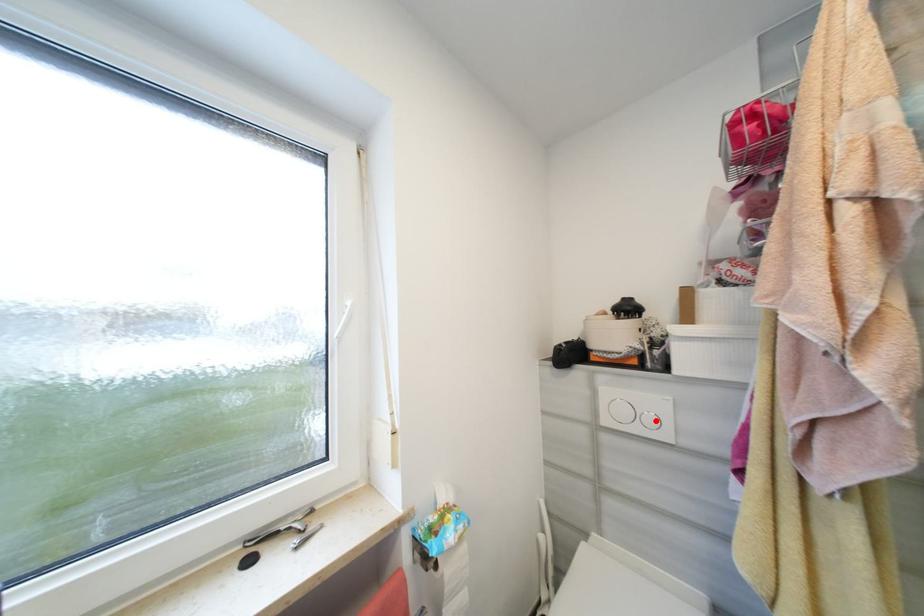
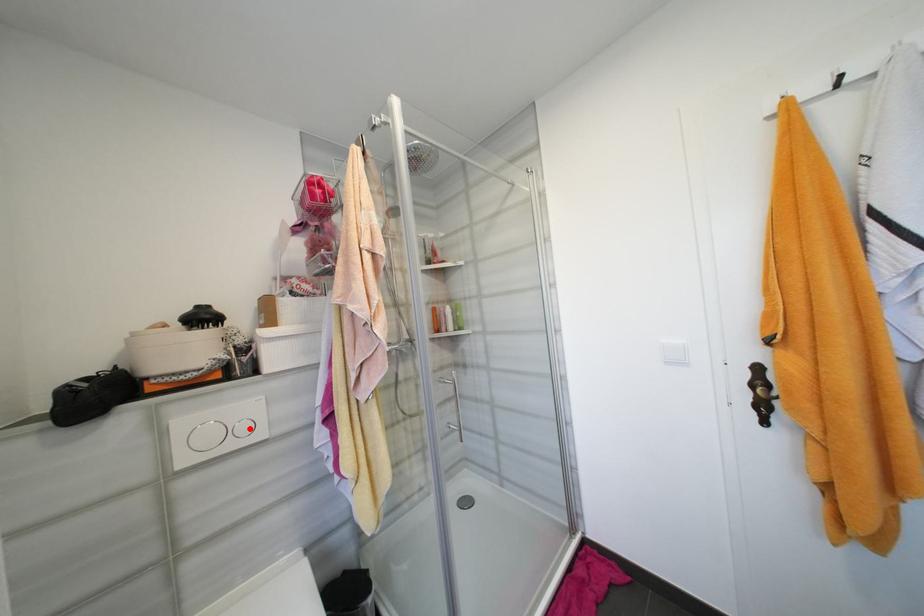
I am providing you with two images of the same scene from different viewpoints. A red point is marked on the first image and another point is marked on the second image. Is the red point in image1 aligned with the point shown in image2?

Yes